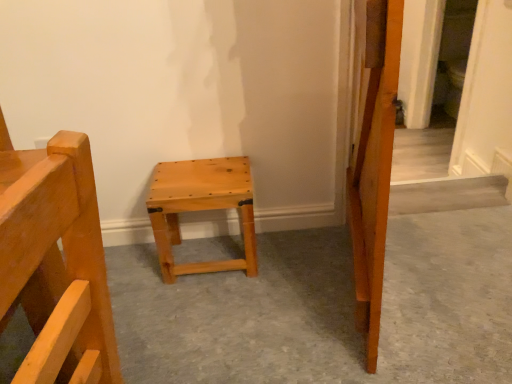
Find the location of `free location to the right of natural wood stool at center`. free location to the right of natural wood stool at center is located at coordinates (294, 256).